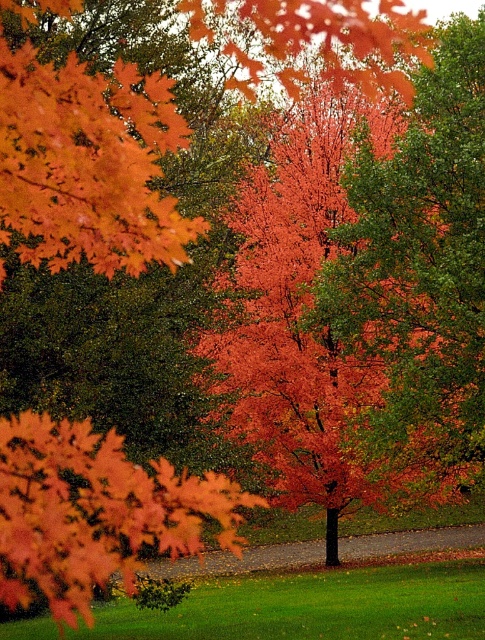
Question: Does shiny orange maple leaf at upper left have a lesser width compared to shiny orange maple at center?

Choices:
 (A) yes
 (B) no

Answer: (A)

Question: Which point is farther from the camera taking this photo?

Choices:
 (A) (76, 518)
 (B) (66, 196)

Answer: (B)

Question: Does shiny orange maple leaf at upper left have a smaller size compared to shiny orange maple at center?

Choices:
 (A) yes
 (B) no

Answer: (A)

Question: Can you confirm if shiny orange maple leaf at upper left is positioned below shiny orange maple at center?

Choices:
 (A) no
 (B) yes

Answer: (A)